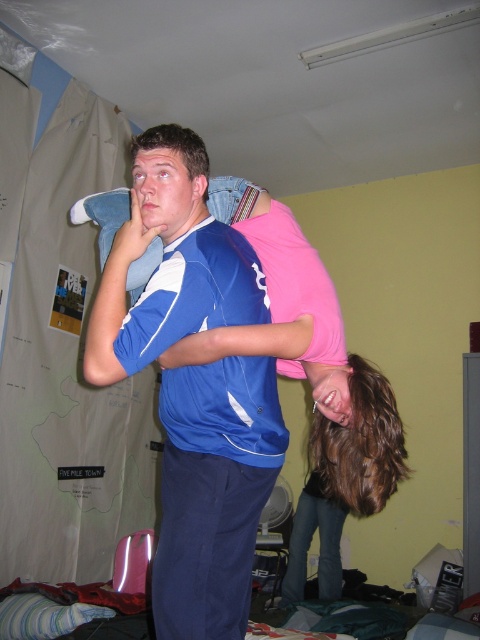
You are an observer in the dorm room scene. You notice the blue jersey at center and the pink matte shirt at upper center. Which clothing item appears taller in the image?

The blue jersey at center appears taller than the pink matte shirt at upper center.

You are a photographer setting up a shot in the dorm room scene. You need to ensure that the blue jersey at center and the pink matte shirt at upper center are both visible in the frame. Based on their positions, which object should you focus on first to capture both in the shot?

The blue jersey at center is positioned under the pink matte shirt at upper center. To capture both in the frame, focus on the pink matte shirt at upper center first, as it is higher up, ensuring the lower blue jersey at center remains within the shot.

You are standing in the dorm room and want to move from point A to point B. Point A is at coordinates point (181, 540) and point B is at coordinates point (305, 484). Which point is closer to you, the observer?

Point (181, 540) is in front of point (305, 484), so it is closer to you.